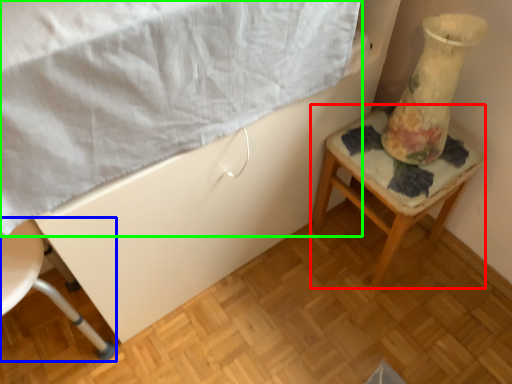
Question: Which object is the closest to the furniture (highlighted by a red box)? Choose among these: chair (highlighted by a blue box) or sheet (highlighted by a green box).

Choices:
 (A) chair
 (B) sheet

Answer: (B)